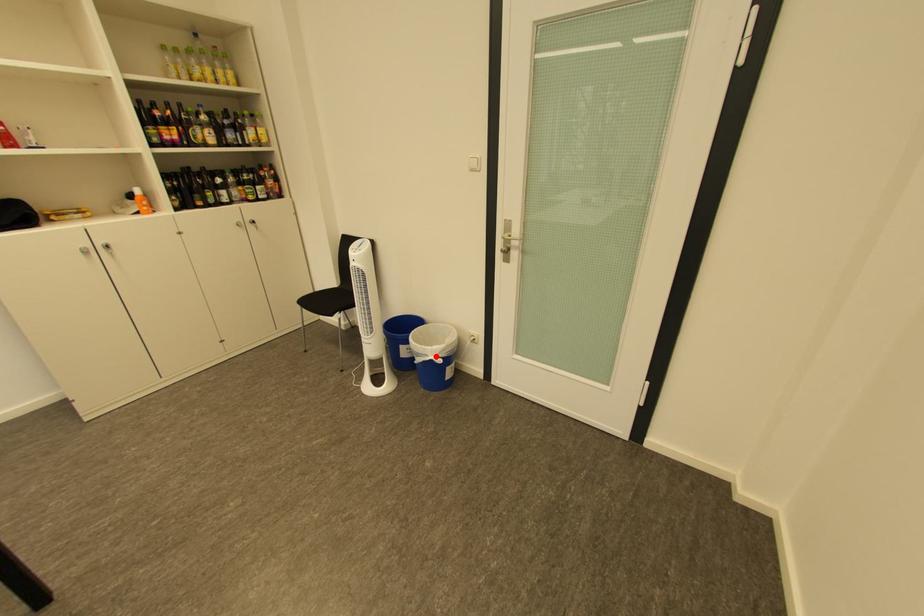
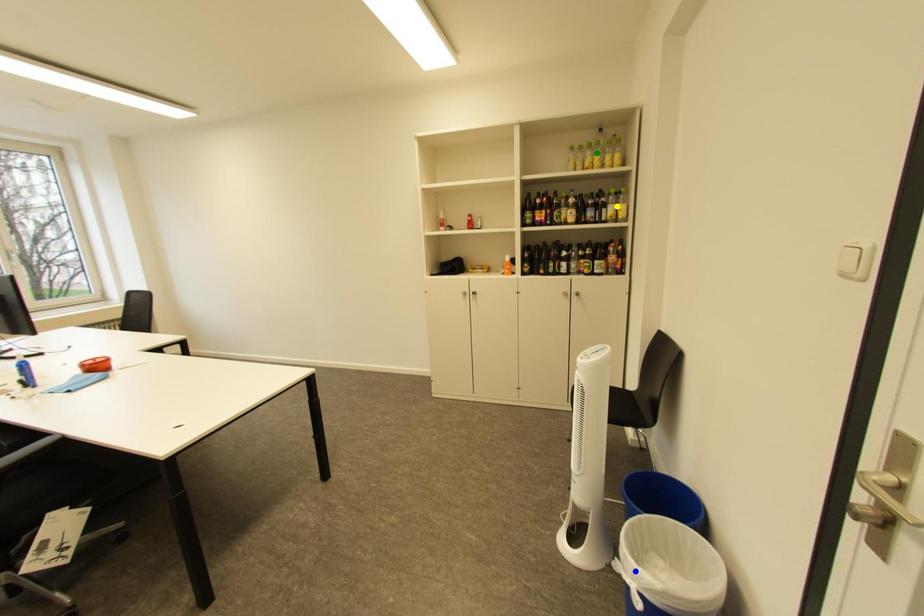
Question: I am providing you with two images of the same scene from different viewpoints. A red point is marked on the first image. You are given multiple points on the second image. Can you choose the point in image 2 that corresponds to the point in image 1?

Choices:
 (A) blue point
 (B) yellow point
 (C) green point

Answer: (A)